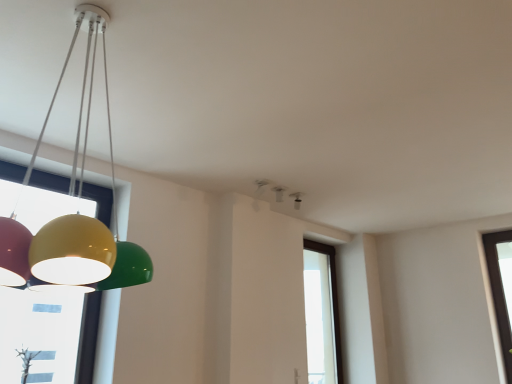
Question: From a real-world perspective, is transparent glass window at center positioned above or below white plastic smoke detector at upper center, which ranks as the 2th lamp in left-to-right order?

Choices:
 (A) above
 (B) below

Answer: (B)

Question: Considering the relative positions of transparent glass window at center and white plastic smoke detector at upper center, which ranks as the 2th lamp in left-to-right order, in the image provided, is transparent glass window at center to the left or to the right of white plastic smoke detector at upper center, which ranks as the 2th lamp in left-to-right order,?

Choices:
 (A) left
 (B) right

Answer: (B)

Question: Which object is the farthest from the white plastic smoke detector at upper center, which ranks as the 2th lamp in left-to-right order?

Choices:
 (A) glossy plastic lamp at left, the first lamp viewed from the left
 (B) transparent glass window at center
 (C) matte black speaker at upper center, placed as the 1th lamp when sorted from right to left

Answer: (A)

Question: Based on their relative distances, which object is nearer to the white plastic smoke detector at upper center, arranged as the 2th lamp when viewed from the back?

Choices:
 (A) glossy plastic lamp at left, which appears as the third lamp when viewed from the right
 (B) transparent glass window at center
 (C) matte black speaker at upper center, the 3th lamp in the front-to-back sequence

Answer: (C)